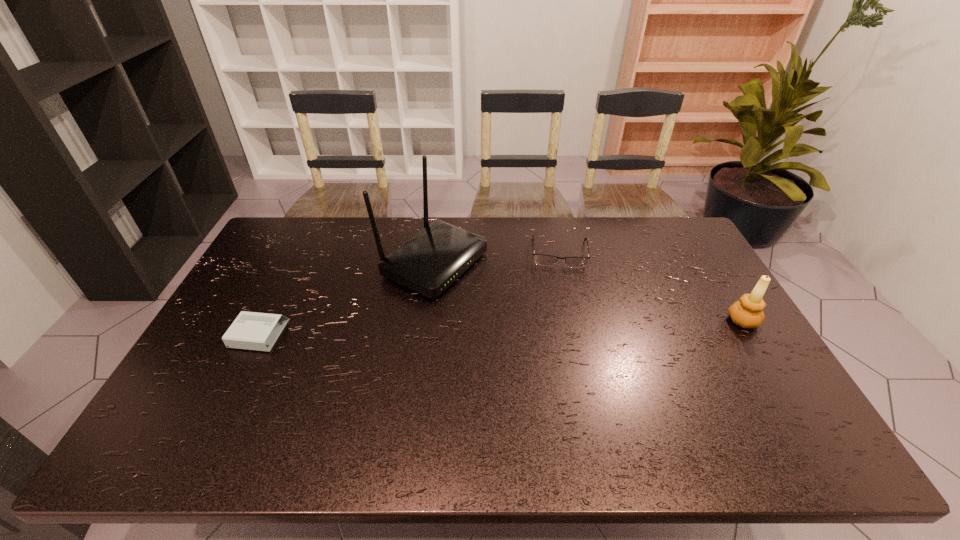
Identify the location of vacant space situated 0.300m on the front-facing side of the tallest object. (564, 322).

The width and height of the screenshot is (960, 540). I want to click on vacant space situated on the front-facing side of the second object from right to left, so click(562, 299).

Identify the location of vacant space positioned on the front-facing side of the second object from right to left. (561, 284).

Image resolution: width=960 pixels, height=540 pixels. In order to click on free space located on the front-facing side of the second object from right to left in this screenshot , I will do `click(564, 350)`.

Find the location of a particular element. The height and width of the screenshot is (540, 960). router that is at the far edge is located at coordinates (428, 263).

Where is `spectacles located in the far edge section of the desktop`? The width and height of the screenshot is (960, 540). spectacles located in the far edge section of the desktop is located at coordinates (545, 260).

Locate an element on the screen. The width and height of the screenshot is (960, 540). object located at the left edge is located at coordinates (250, 330).

At what (x,y) coordinates should I click in order to perform the action: click on object at the right edge. Please return your answer as a coordinate pair (x, y). This screenshot has height=540, width=960. Looking at the image, I should click on (747, 312).

Locate an element on the screen. The image size is (960, 540). blank space at the far edge is located at coordinates (538, 248).

Find the location of a particular element. The width and height of the screenshot is (960, 540). free spot at the near edge of the desktop is located at coordinates (594, 397).